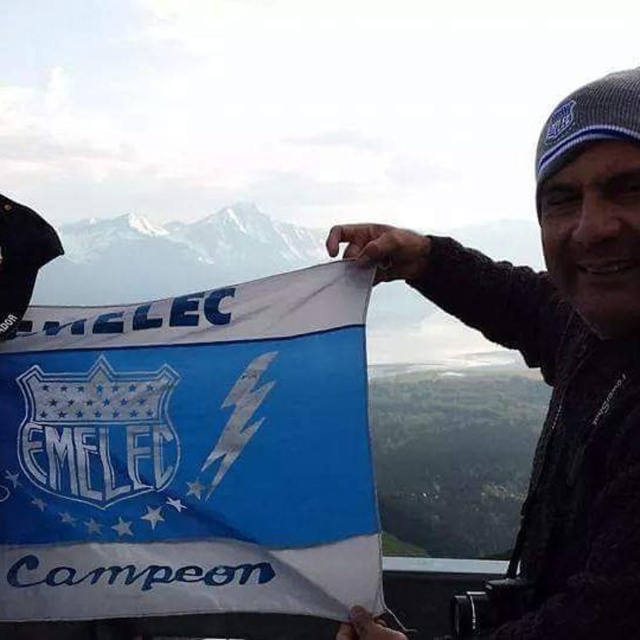
Is point (252, 348) positioned behind point (556, 570)?

Yes, point (252, 348) is farther from viewer.

Which is behind, point (218, 486) or point (483, 268)?

Positioned behind is point (483, 268).

Is point (280, 470) more distant than point (595, 272)?

Yes.

Where is `blue fabric flag at center`? blue fabric flag at center is located at coordinates (189, 454).